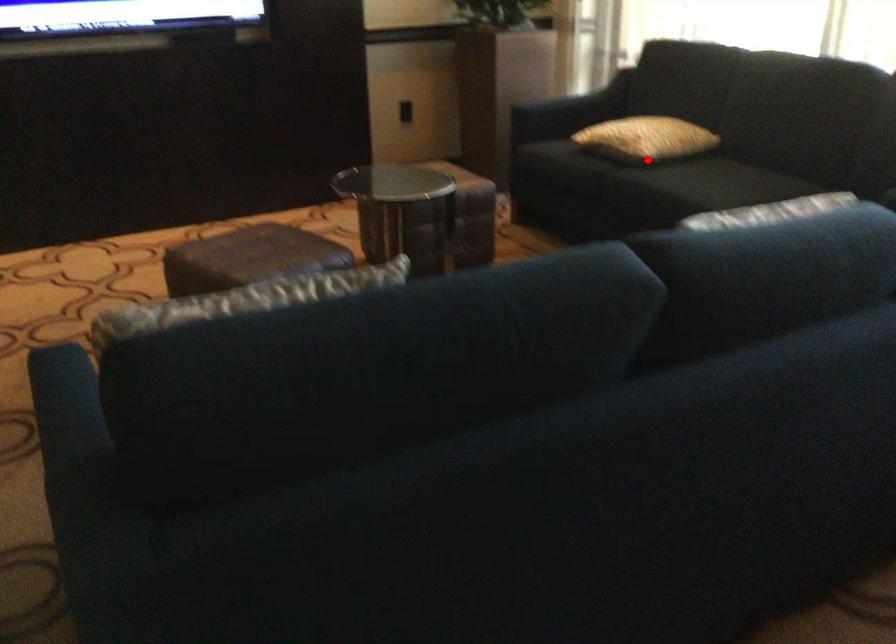
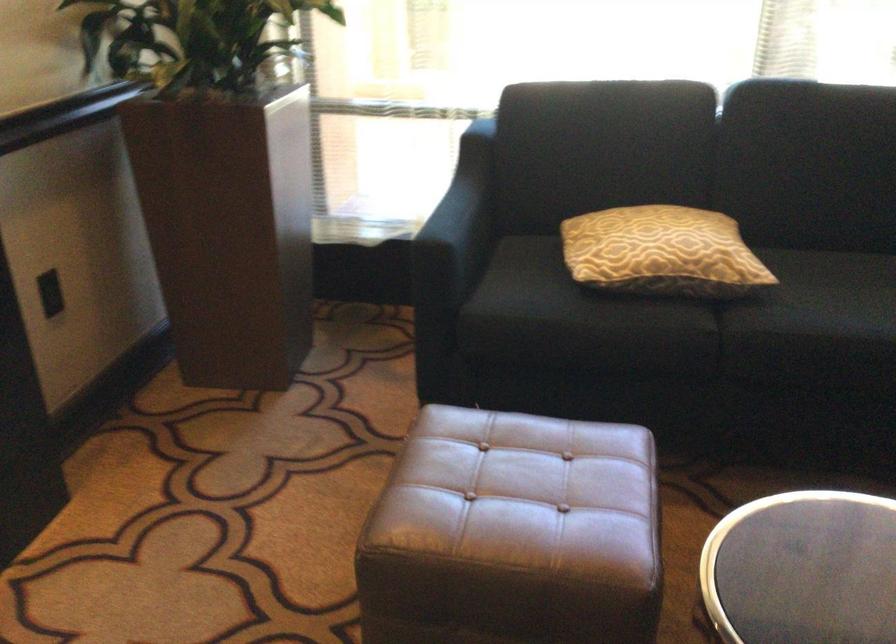
The point at the highlighted location is marked in the first image. Where is the corresponding point in the second image?

(752, 289)